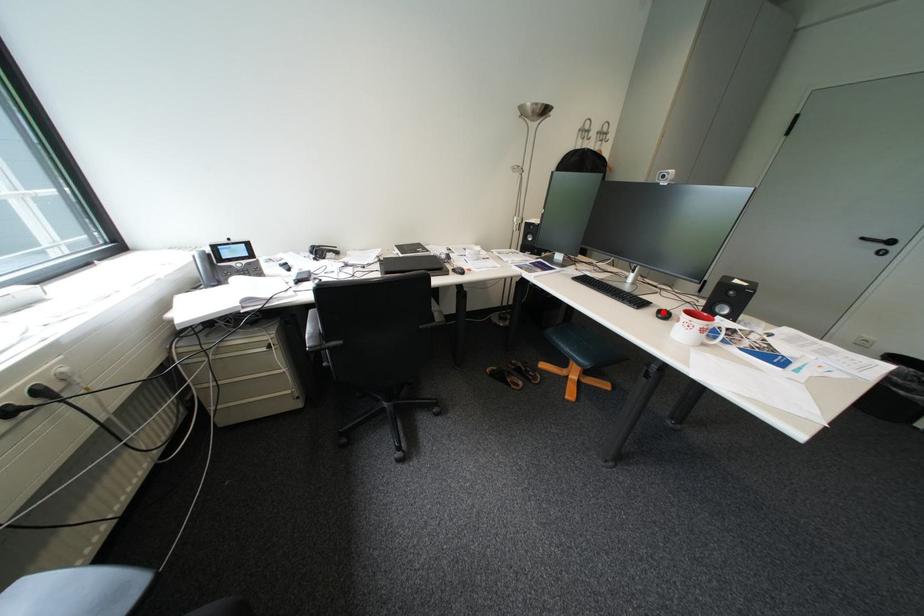
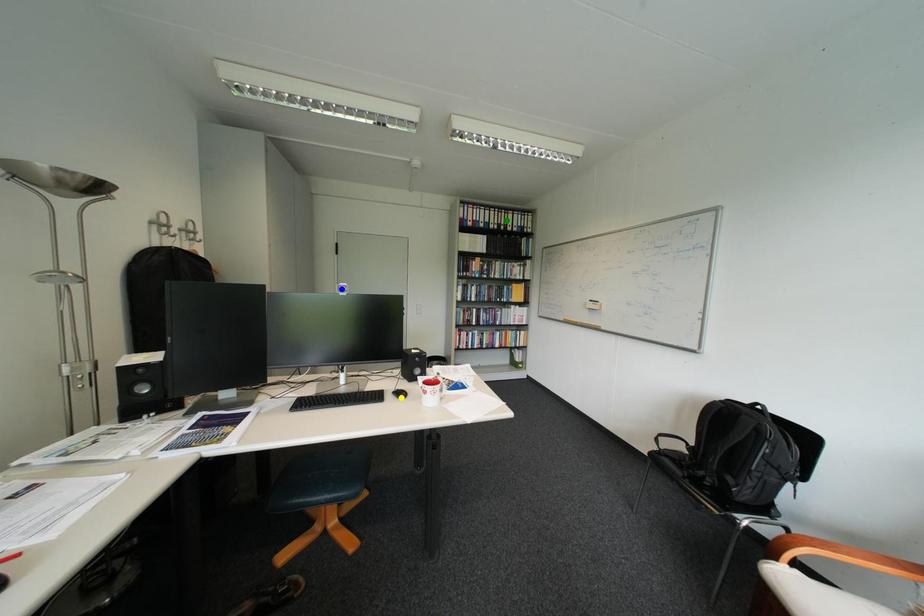
Question: I am providing you with two images of the same scene from different viewpoints. A red point is marked on the first image. You are given multiple points on the second image. Which point in image 2 is actually the same real-world point as the red point in image 1?

Choices:
 (A) blue point
 (B) yellow point
 (C) green point

Answer: (B)